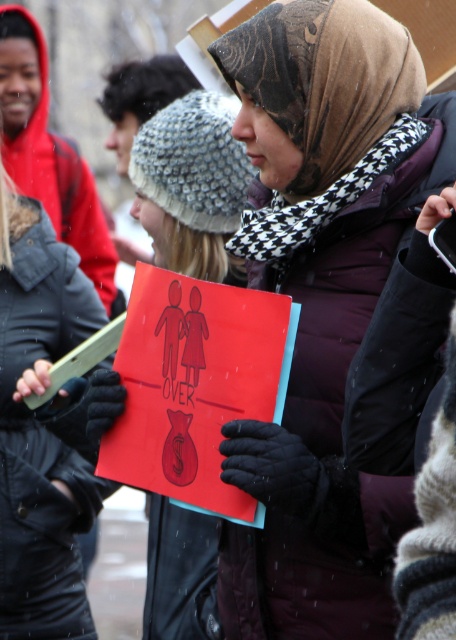
Question: Considering the relative positions of matte purple jacket at center and matte black jacket at left in the image provided, where is matte purple jacket at center located with respect to matte black jacket at left?

Choices:
 (A) below
 (B) above

Answer: (B)

Question: Which point is farther from the camera taking this photo?

Choices:
 (A) (1, 417)
 (B) (262, 180)

Answer: (A)

Question: Which object is closer to the camera taking this photo?

Choices:
 (A) matte purple jacket at center
 (B) matte black jacket at left

Answer: (A)

Question: Observing the image, what is the correct spatial positioning of matte purple jacket at center in reference to matte black jacket at left?

Choices:
 (A) above
 (B) below

Answer: (A)

Question: Considering the relative positions of matte purple jacket at center and matte black jacket at left in the image provided, where is matte purple jacket at center located with respect to matte black jacket at left?

Choices:
 (A) left
 (B) right

Answer: (B)